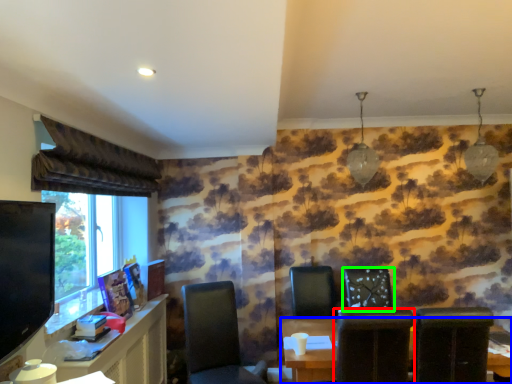
Question: Based on their relative distances, which object is nearer to chair (highlighted by a red box)? Choose from table (highlighted by a blue box) and chair (highlighted by a green box).

Choices:
 (A) table
 (B) chair

Answer: (A)